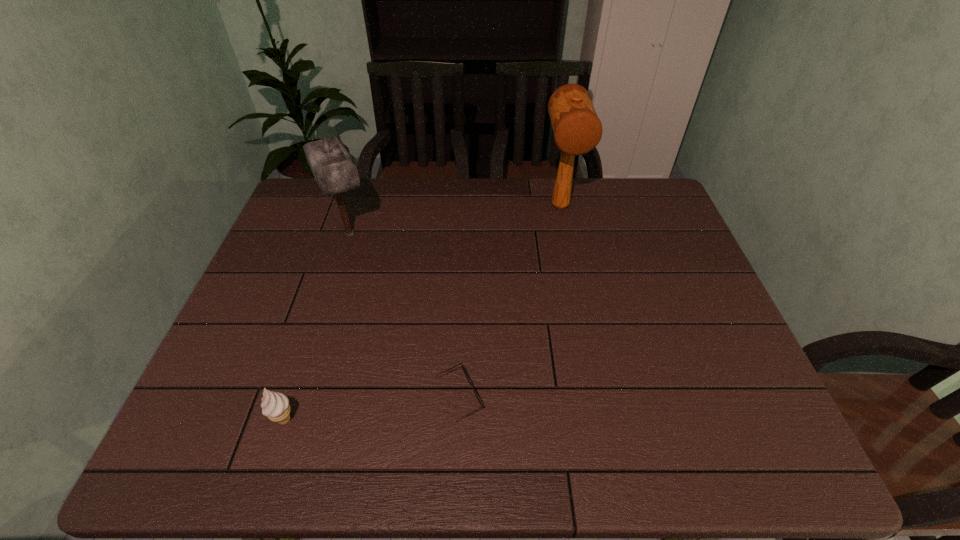
Locate an element on the screen. This screenshot has width=960, height=540. spectacles located at the near edge is located at coordinates (463, 369).

Where is `object located at the left edge`? The width and height of the screenshot is (960, 540). object located at the left edge is located at coordinates (335, 171).

This screenshot has width=960, height=540. What are the coordinates of `object located at the far left corner` in the screenshot? It's located at (335, 171).

Find the location of a particular element. blank space at the far edge of the desktop is located at coordinates (416, 201).

Image resolution: width=960 pixels, height=540 pixels. In the image, there is a desktop. In order to click on free space at the near edge in this screenshot , I will do `click(653, 454)`.

Find the location of a particular element. vacant space at the left edge of the desktop is located at coordinates (307, 245).

In the image, there is a desktop. Find the location of `free space at the right edge`. free space at the right edge is located at coordinates (644, 267).

The height and width of the screenshot is (540, 960). In the image, there is a desktop. What are the coordinates of `blank space at the far left corner` in the screenshot? It's located at (309, 202).

You are a GUI agent. You are given a task and a screenshot of the screen. Output one action in this format:
    pyautogui.click(x=<x>, y=<y>)
    Task: Click on the blank space at the far right corner
    The height and width of the screenshot is (540, 960).
    Given the screenshot: What is the action you would take?
    pyautogui.click(x=636, y=189)

This screenshot has width=960, height=540. In the image, there is a desktop. Identify the location of vacant space at the near right corner. (716, 435).